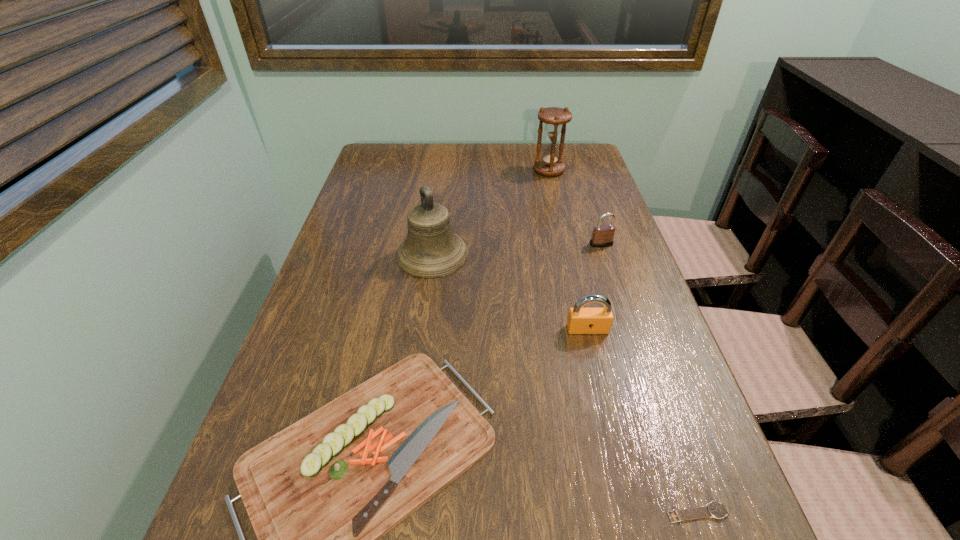
At what (x,y) coordinates should I click in order to perform the action: click on vacant region between the farther padlock and the bell. Please return your answer as a coordinate pair (x, y). Looking at the image, I should click on (516, 249).

Where is `vacant region between the farthest object and the bell`? The image size is (960, 540). vacant region between the farthest object and the bell is located at coordinates (491, 212).

You are a GUI agent. You are given a task and a screenshot of the screen. Output one action in this format:
    pyautogui.click(x=<x>, y=<y>)
    Task: Click on the vacant point located between the third nearest object and the bell
    Image resolution: width=960 pixels, height=540 pixels.
    Given the screenshot: What is the action you would take?
    pyautogui.click(x=510, y=292)

I want to click on free space between the right padlock and the watch, so click(649, 379).

Identify the location of vacant space that's between the farthest object and the left padlock. This screenshot has width=960, height=540. [x=568, y=250].

Locate an element on the screen. The width and height of the screenshot is (960, 540). free space between the right padlock and the bell is located at coordinates (516, 249).

At what (x,y) coordinates should I click in order to perform the action: click on the third closest object to the bell. Please return your answer as a coordinate pair (x, y). This screenshot has width=960, height=540. Looking at the image, I should click on (602, 236).

Where is `object that is the fifth closest to the left padlock`? The width and height of the screenshot is (960, 540). object that is the fifth closest to the left padlock is located at coordinates 550,164.

Locate an element on the screen. The height and width of the screenshot is (540, 960). free space that satisfies the following two spatial constraints: 1. on the back side of the farthest object; 2. on the right side of the bell is located at coordinates (444, 171).